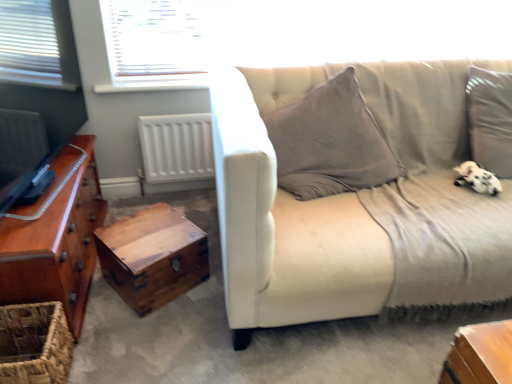
Measure the distance between point (432, 287) and camera.

1.44 meters.

Locate an element on the screen. This screenshot has width=512, height=384. gray corduroy couch at right is located at coordinates (359, 204).

This screenshot has height=384, width=512. In order to click on shiny brown wooden chest of drawers at left in this screenshot , I will do (55, 237).

Locate an element on the screen. white fluffy dog at lower right is located at coordinates (477, 178).

Considering the positions of point (8, 306) and point (486, 187), is point (8, 306) closer or farther from the camera than point (486, 187)?

Point (8, 306) is closer to the camera than point (486, 187).

From a real-world perspective, which is physically below, woven brown basket at lower left or white fluffy dog at lower right?

woven brown basket at lower left.

I want to click on basket below the white fluffy dog at lower right (from the image's perspective), so click(34, 344).

Which object is more forward, woven brown basket at lower left or white fluffy dog at lower right?

Positioned in front is woven brown basket at lower left.

In the scene shown: Does wooden chest at lower left have a larger size compared to woven brown basket at lower left?

Indeed, wooden chest at lower left has a larger size compared to woven brown basket at lower left.

Is wooden chest at lower left wider than woven brown basket at lower left?

Indeed, wooden chest at lower left has a greater width compared to woven brown basket at lower left.

This screenshot has height=384, width=512. In order to click on basket located below the wooden chest at lower left (from the image's perspective) in this screenshot , I will do `click(34, 344)`.

Image resolution: width=512 pixels, height=384 pixels. Find the location of `animal above the wooden chest at lower left (from the image's perspective)`. animal above the wooden chest at lower left (from the image's perspective) is located at coordinates (477, 178).

From a real-world perspective, is white fluffy dog at lower right positioned under wooden chest at lower left based on gravity?

No, from a real-world perspective, white fluffy dog at lower right is not under wooden chest at lower left.

Who is smaller, white fluffy dog at lower right or wooden chest at lower left?

With smaller size is white fluffy dog at lower right.

What's the angular difference between white fluffy dog at lower right and wooden chest at lower left's facing directions?

31.9 degrees separate the facing orientations of white fluffy dog at lower right and wooden chest at lower left.

Is white fluffy dog at lower right aimed at shiny brown wooden chest of drawers at left?

No.

Is white fluffy dog at lower right positioned in front of shiny brown wooden chest of drawers at left?

No, white fluffy dog at lower right is further to the viewer.

Considering the points (458, 183) and (73, 241), which point is in front, point (458, 183) or point (73, 241)?

Point (73, 241)

From the picture: Are white fluffy dog at lower right and shiny brown wooden chest of drawers at left far apart?

Yes, white fluffy dog at lower right is far from shiny brown wooden chest of drawers at left.

Based on the photo, can you confirm if shiny brown wooden chest of drawers at left is thinner than woven brown basket at lower left?

In fact, shiny brown wooden chest of drawers at left might be wider than woven brown basket at lower left.

From their relative heights in the image, would you say shiny brown wooden chest of drawers at left is taller or shorter than woven brown basket at lower left?

In the image, shiny brown wooden chest of drawers at left appears to be taller than woven brown basket at lower left.

Where is `chest of drawers that appears on the left of woven brown basket at lower left`? chest of drawers that appears on the left of woven brown basket at lower left is located at coordinates (55, 237).

Does point (75, 243) appear closer or farther from the camera than point (45, 322)?

Point (75, 243) is positioned farther from the camera compared to point (45, 322).

From the image's perspective, is shiny brown wooden chest of drawers at left located above or below gray corduroy couch at right?

shiny brown wooden chest of drawers at left is situated lower than gray corduroy couch at right in the image.

How different are the orientations of shiny brown wooden chest of drawers at left and gray corduroy couch at right in degrees?

The angular difference between shiny brown wooden chest of drawers at left and gray corduroy couch at right is 90.7 degrees.

Does shiny brown wooden chest of drawers at left lie in front of gray corduroy couch at right?

No, shiny brown wooden chest of drawers at left is further to the viewer.

I want to click on studio couch on the right of shiny brown wooden chest of drawers at left, so click(x=359, y=204).

Which object is wider, woven brown basket at lower left or shiny brown wooden chest of drawers at left?

Wider between the two is shiny brown wooden chest of drawers at left.

Considering the sizes of objects woven brown basket at lower left and shiny brown wooden chest of drawers at left in the image provided, who is bigger, woven brown basket at lower left or shiny brown wooden chest of drawers at left?

shiny brown wooden chest of drawers at left.

Would you say woven brown basket at lower left is a long distance from shiny brown wooden chest of drawers at left?

Actually, woven brown basket at lower left and shiny brown wooden chest of drawers at left are a little close together.

Image resolution: width=512 pixels, height=384 pixels. Find the location of `animal located above the woven brown basket at lower left (from the image's perspective)`. animal located above the woven brown basket at lower left (from the image's perspective) is located at coordinates (477, 178).

What are the coordinates of `basket that is above the wooden chest at lower left (from a real-world perspective)` in the screenshot? It's located at (34, 344).

Considering their positions, is shiny brown wooden chest of drawers at left positioned closer to white fluffy dog at lower right than wooden chest at lower left?

The object closer to white fluffy dog at lower right is wooden chest at lower left.

Based on their spatial positions, is wooden chest at lower left or shiny brown wooden chest of drawers at left further from white fluffy dog at lower right?

shiny brown wooden chest of drawers at left.

Based on the photo, when comparing their distances from wooden chest at lower left, does woven brown basket at lower left or gray corduroy couch at right seem closer?

Based on the image, woven brown basket at lower left appears to be nearer to wooden chest at lower left.

When comparing their distances from white fluffy dog at lower right, does gray corduroy couch at right or shiny brown wooden chest of drawers at left seem closer?

Among the two, gray corduroy couch at right is located nearer to white fluffy dog at lower right.

Looking at this image, from the image, which object appears to be farther from wooden chest at lower left, gray corduroy couch at right or white fluffy dog at lower right?

The object further to wooden chest at lower left is white fluffy dog at lower right.

From the picture: Looking at the image, which one is located further to woven brown basket at lower left, wooden chest at lower left or gray corduroy couch at right?

gray corduroy couch at right is positioned further to the anchor woven brown basket at lower left.

Looking at the image, which one is located closer to woven brown basket at lower left, gray corduroy couch at right or shiny brown wooden chest of drawers at left?

The object closer to woven brown basket at lower left is shiny brown wooden chest of drawers at left.

Based on their spatial positions, is white fluffy dog at lower right or woven brown basket at lower left closer to shiny brown wooden chest of drawers at left?

The object closer to shiny brown wooden chest of drawers at left is woven brown basket at lower left.

This screenshot has height=384, width=512. In order to click on basket situated between shiny brown wooden chest of drawers at left and white fluffy dog at lower right from left to right in this screenshot , I will do `click(34, 344)`.

This screenshot has height=384, width=512. What are the coordinates of `table between shiny brown wooden chest of drawers at left and white fluffy dog at lower right from left to right` in the screenshot? It's located at 152,257.

Find the location of `basket situated between shiny brown wooden chest of drawers at left and gray corduroy couch at right from left to right`. basket situated between shiny brown wooden chest of drawers at left and gray corduroy couch at right from left to right is located at coordinates (34, 344).

Where is `studio couch situated between woven brown basket at lower left and white fluffy dog at lower right from left to right`? The width and height of the screenshot is (512, 384). studio couch situated between woven brown basket at lower left and white fluffy dog at lower right from left to right is located at coordinates (359, 204).